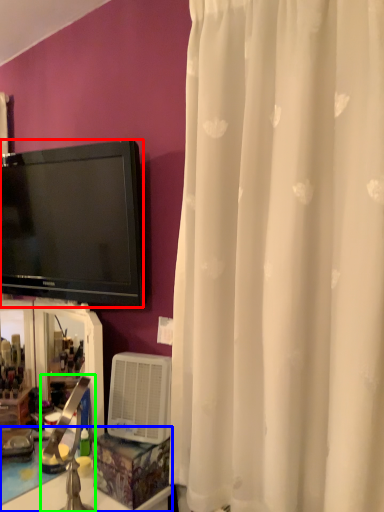
Question: Estimate the real-world distances between objects in this image. Which object is farther from television (highlighted by a red box), counter top (highlighted by a blue box) or faucet (highlighted by a green box)?

Choices:
 (A) counter top
 (B) faucet

Answer: (A)